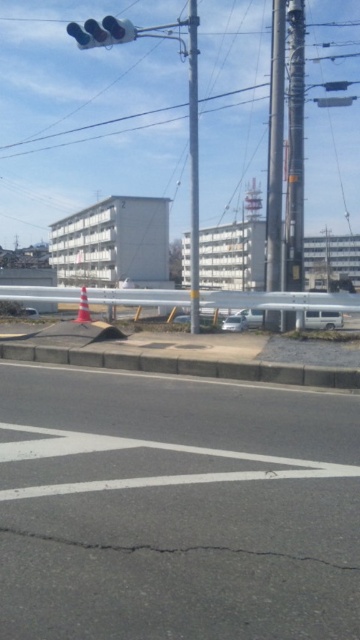
You are a pedestrian standing on the sidewalk and want to cross the street. There is a smooth metallic pole at center and an orange reflective cone at center. Which object is closer to the curb?

The orange reflective cone at center is closer to the curb because the smooth metallic pole at center is to the right of it.

You are a city planner reviewing this street layout. You need to ensure that all poles along the road are at least 3 meters tall for safety regulations. Given the information in the scene, can you confirm if the metallic gray pole at upper right and the metallic traffic light at upper center meet this requirement?

The metallic gray pole at upper right has a lesser height compared to the metallic traffic light at upper center. Since the traffic light pole must be at least 3 meters tall to function properly and meet safety standards, the metallic gray pole at upper right may not meet the 3 meter requirement if it is shorter than the traffic light pole.